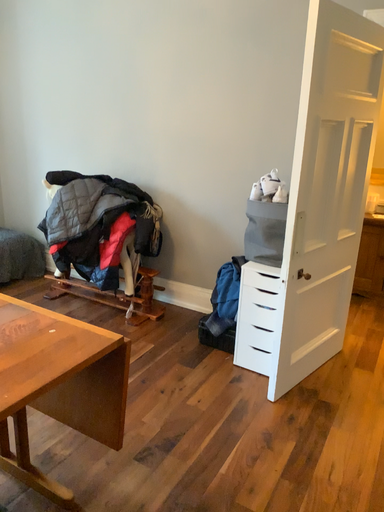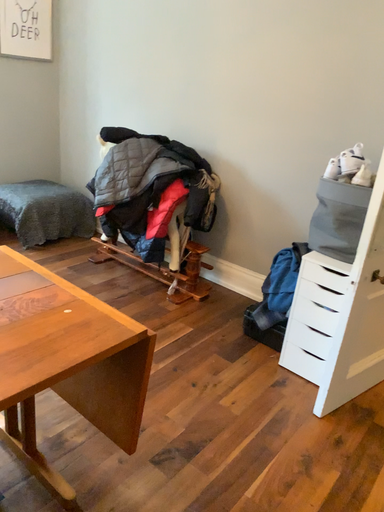
Question: Which way did the camera rotate in the video?

Choices:
 (A) rotated right
 (B) rotated left

Answer: (B)